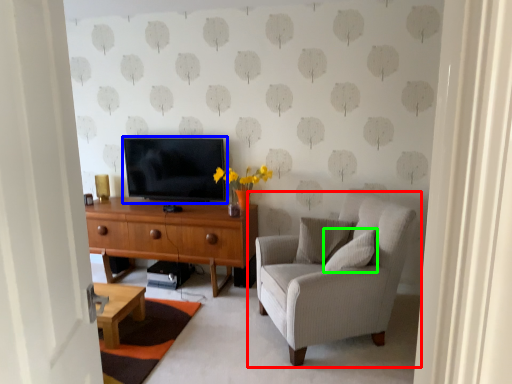
Question: Which object is positioned closest to chair (highlighted by a red box)? Select from television (highlighted by a blue box) and pillow (highlighted by a green box).

Choices:
 (A) television
 (B) pillow

Answer: (B)